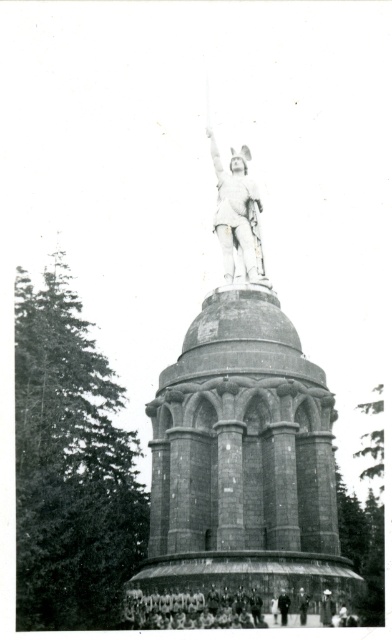
Can you confirm if white stone statue at center is thinner than polished bronze statue at center?

No, white stone statue at center is not thinner than polished bronze statue at center.

The height and width of the screenshot is (640, 392). Describe the element at coordinates (243, 440) in the screenshot. I see `white stone statue at center` at that location.

Does point (326, 492) come farther from viewer compared to point (248, 216)?

No, it is in front of (248, 216).

Locate an element on the screen. This screenshot has height=640, width=392. white stone statue at center is located at coordinates (243, 440).

Can you confirm if white stone statue at center is wider than white statue at center?

Indeed, white stone statue at center has a greater width compared to white statue at center.

Who is shorter, white stone statue at center or white statue at center?

With less height is white statue at center.

Image resolution: width=392 pixels, height=640 pixels. In order to click on white stone statue at center in this screenshot , I will do `click(243, 440)`.

Is point (223, 253) more distant than point (281, 620)?

That is True.

Is polished bronze statue at center to the right of dark gray uniform at center from the viewer's perspective?

No, polished bronze statue at center is not to the right of dark gray uniform at center.

Is point (221, 182) positioned after point (288, 608)?

Yes, it is behind point (288, 608).

Locate an element on the screen. This screenshot has width=392, height=640. polished bronze statue at center is located at coordinates (237, 216).